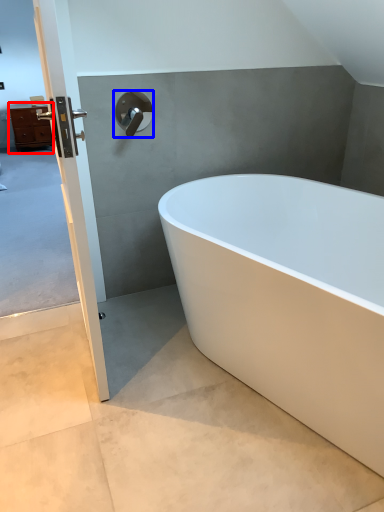
Question: Which point is closer to the camera, chest of drawers (highlighted by a red box) or tap (highlighted by a blue box)?

Choices:
 (A) chest of drawers
 (B) tap

Answer: (B)